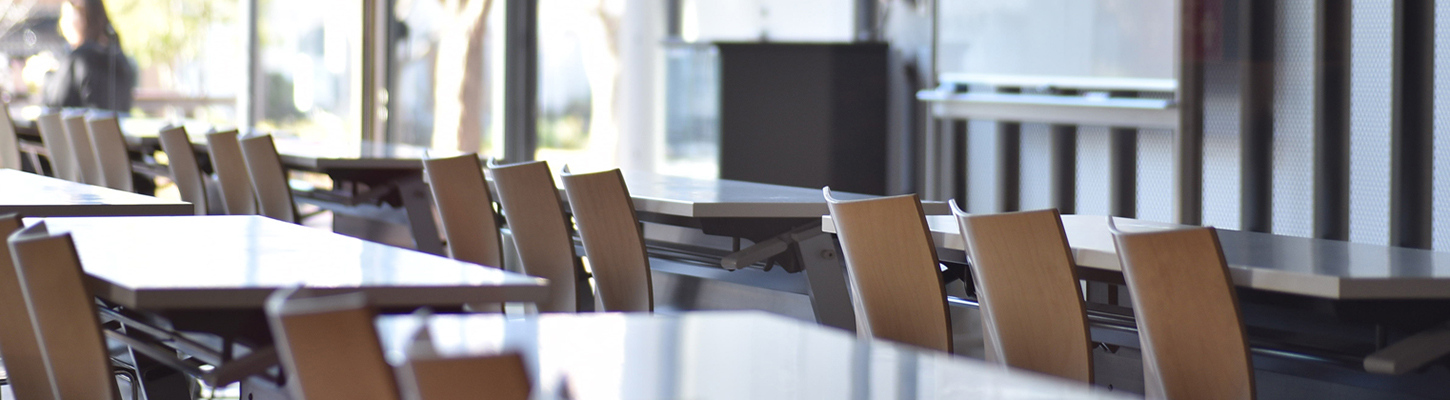
Where is `tables`? tables is located at coordinates (194, 234), (51, 190), (331, 142), (136, 119), (683, 194), (1275, 258), (766, 339).